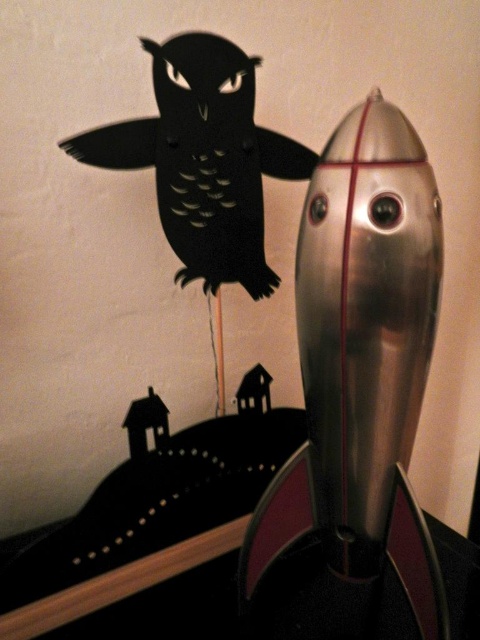
Question: Which point is closer to the camera?

Choices:
 (A) shiny metallic rocket at right
 (B) black paper owl at upper left

Answer: (A)

Question: Can you confirm if shiny metallic rocket at right is positioned above black paper owl at upper left?

Choices:
 (A) yes
 (B) no

Answer: (B)

Question: Does shiny metallic rocket at right lie in front of black paper owl at upper left?

Choices:
 (A) yes
 (B) no

Answer: (A)

Question: Does shiny metallic rocket at right have a larger size compared to black paper owl at upper left?

Choices:
 (A) no
 (B) yes

Answer: (B)

Question: Which point is farther from the camera taking this photo?

Choices:
 (A) (385, 557)
 (B) (183, 193)

Answer: (B)

Question: Which point is closer to the camera?

Choices:
 (A) black paper owl at upper left
 (B) shiny metallic rocket at right

Answer: (B)